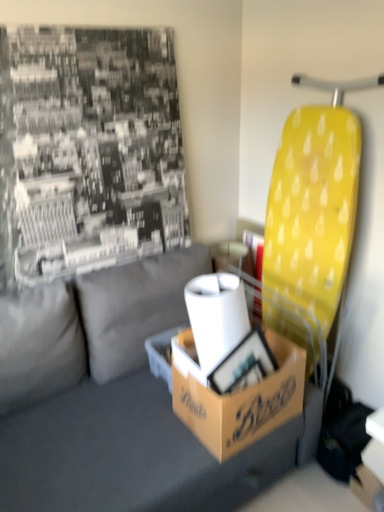
Question: Considering the relative sizes of gray fabric couch at center and brown cardboard box at center in the image provided, is gray fabric couch at center thinner than brown cardboard box at center?

Choices:
 (A) yes
 (B) no

Answer: (B)

Question: Does gray fabric couch at center have a smaller size compared to brown cardboard box at center?

Choices:
 (A) no
 (B) yes

Answer: (A)

Question: Could you tell me if gray fabric couch at center is facing brown cardboard box at center?

Choices:
 (A) no
 (B) yes

Answer: (B)

Question: Considering the relative sizes of gray fabric couch at center and brown cardboard box at center in the image provided, is gray fabric couch at center bigger than brown cardboard box at center?

Choices:
 (A) no
 (B) yes

Answer: (B)

Question: From the image's perspective, is gray fabric couch at center over brown cardboard box at center?

Choices:
 (A) yes
 (B) no

Answer: (B)

Question: Can you confirm if gray fabric couch at center is positioned to the right of brown cardboard box at center?

Choices:
 (A) no
 (B) yes

Answer: (A)

Question: Does brown cardboard box at center have a greater height compared to brown cardboard box at center?

Choices:
 (A) yes
 (B) no

Answer: (B)

Question: Considering the relative sizes of brown cardboard box at center and brown cardboard box at center in the image provided, is brown cardboard box at center smaller than brown cardboard box at center?

Choices:
 (A) no
 (B) yes

Answer: (B)

Question: Considering the relative sizes of brown cardboard box at center and brown cardboard box at center in the image provided, is brown cardboard box at center wider than brown cardboard box at center?

Choices:
 (A) no
 (B) yes

Answer: (A)

Question: Is brown cardboard box at center not close to brown cardboard box at center?

Choices:
 (A) no
 (B) yes

Answer: (A)

Question: From a real-world perspective, is brown cardboard box at center beneath brown cardboard box at center?

Choices:
 (A) no
 (B) yes

Answer: (B)

Question: From the image's perspective, is brown cardboard box at center under brown cardboard box at center?

Choices:
 (A) yes
 (B) no

Answer: (B)

Question: Is brown cardboard box at center positioned with its back to white matte toilet paper at center?

Choices:
 (A) yes
 (B) no

Answer: (B)